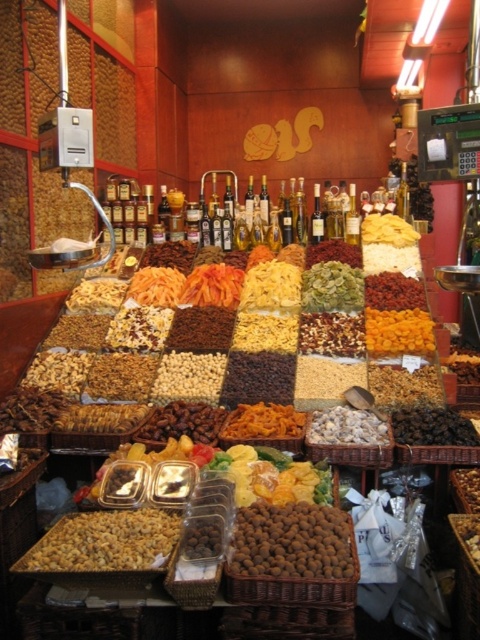
Question: Does dark brown dried fruit at lower right lie behind white matte dried fruits at center?

Choices:
 (A) yes
 (B) no

Answer: (A)

Question: Among these objects, which one is farthest from the camera?

Choices:
 (A) dark brown dried fruit at lower right
 (B) orange dried fruit at center

Answer: (B)

Question: Which object is the closest to the brown textured nuts at center?

Choices:
 (A) brown matte dried fruits at center
 (B) orange dried fruit at center

Answer: (A)

Question: Can you confirm if dark brown dried fruit at lower right is positioned to the left of dark brown dried fruit at center?

Choices:
 (A) no
 (B) yes

Answer: (B)

Question: Is brown matte dried fruits at center thinner than white matte dried fruits at center?

Choices:
 (A) yes
 (B) no

Answer: (B)

Question: Which point is farther to the camera?

Choices:
 (A) white matte dried fruits at center
 (B) dark brown dried fruit at center
 (C) brown crunchy nuts at lower left
 (D) orange dried fruit at center

Answer: (B)